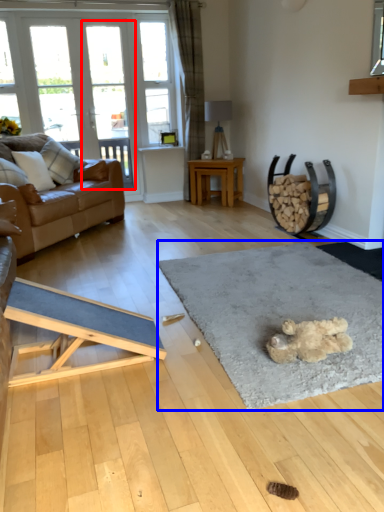
Question: Which of the following is the farthest to the observer, screen door (highlighted by a red box) or mat (highlighted by a blue box)?

Choices:
 (A) screen door
 (B) mat

Answer: (A)